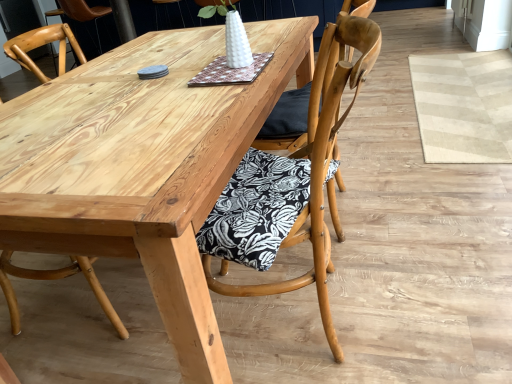
Question: Should I look upward or downward to see natural wood table at center?

Choices:
 (A) down
 (B) up

Answer: (B)